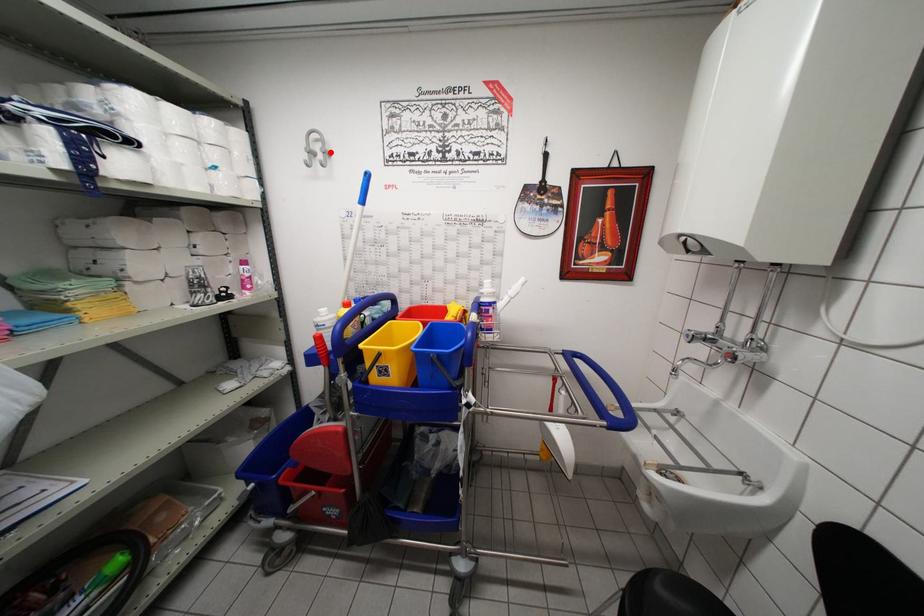
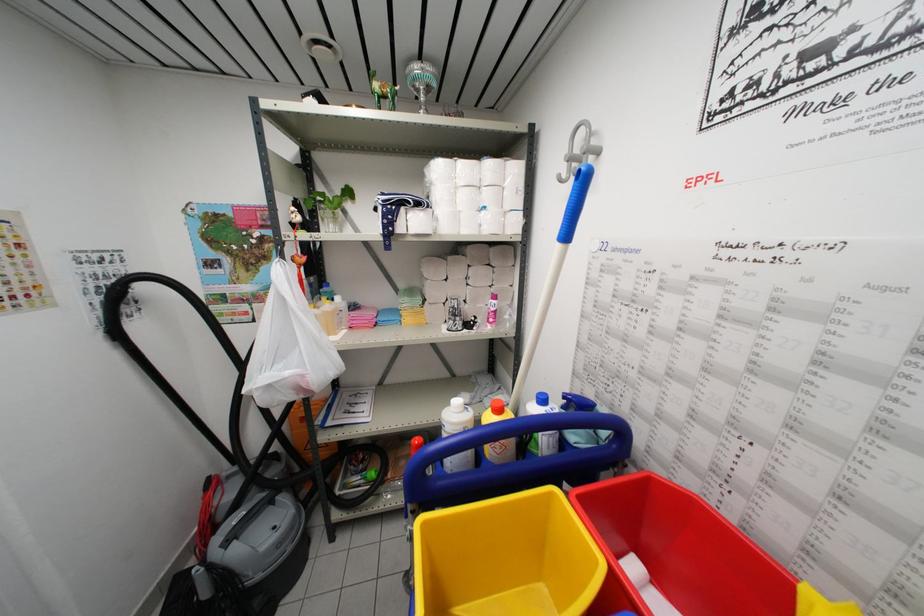
In the second image, find the point that corresponds to the highlighted location in the first image.

(597, 148)